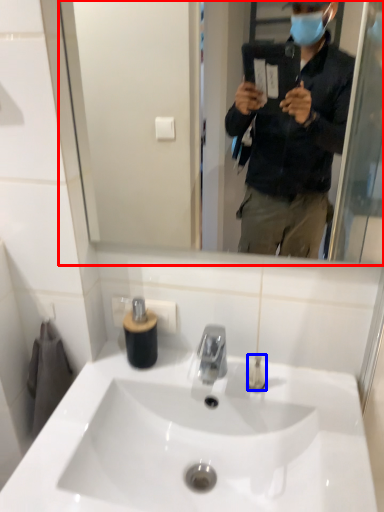
Question: Which object is closer to the camera taking this photo, mirror (highlighted by a red box) or toiletry (highlighted by a blue box)?

Choices:
 (A) mirror
 (B) toiletry

Answer: (A)